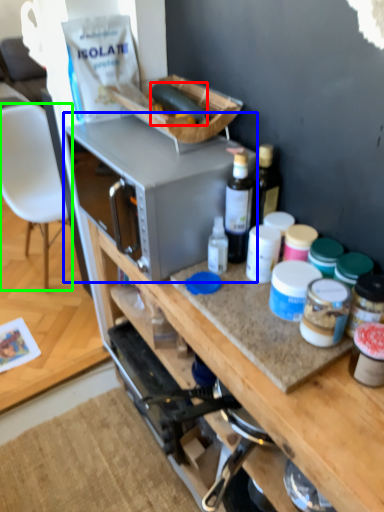
Question: Which object is the closest to the food (highlighted by a red box)? Choose among these: microwave oven (highlighted by a blue box) or chair (highlighted by a green box).

Choices:
 (A) microwave oven
 (B) chair

Answer: (A)